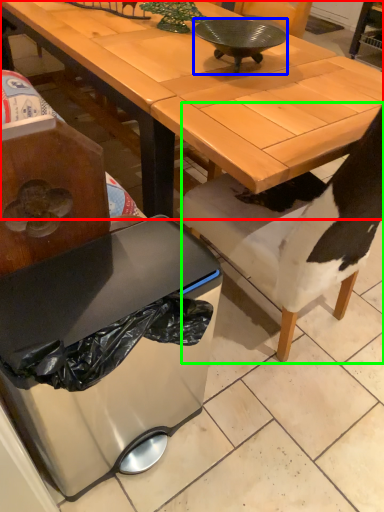
Question: Which object is positioned farthest from desk (highlighted by a red box)? Select from bowl (highlighted by a blue box) and chair (highlighted by a green box).

Choices:
 (A) bowl
 (B) chair

Answer: (B)